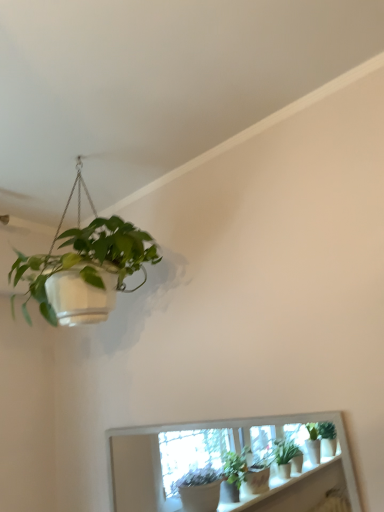
Identify the location of white ceramic window at upper center. Image resolution: width=384 pixels, height=512 pixels. (190, 457).

This screenshot has height=512, width=384. Describe the element at coordinates (190, 457) in the screenshot. I see `white ceramic window at upper center` at that location.

The image size is (384, 512). Find the location of `white ceramic window at upper center`. white ceramic window at upper center is located at coordinates (190, 457).